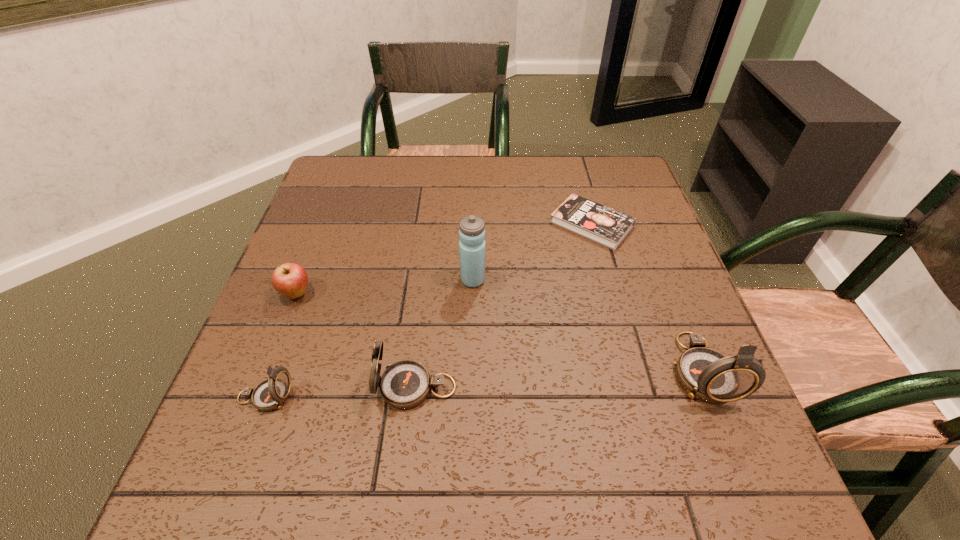
Locate an element on the screen. The image size is (960, 540). free space between the apple and the leftmost compass is located at coordinates (281, 345).

Locate an element on the screen. This screenshot has width=960, height=540. unoccupied area between the leftmost compass and the rightmost compass is located at coordinates (483, 383).

The width and height of the screenshot is (960, 540). I want to click on free space between the water bottle and the fourth shortest object, so click(x=444, y=334).

The width and height of the screenshot is (960, 540). I want to click on vacant space in between the shortest object and the fourth object from left to right, so click(532, 252).

Where is `vacant space that is in between the apple and the second compass from left to right`? vacant space that is in between the apple and the second compass from left to right is located at coordinates (356, 340).

Locate an element on the screen. The width and height of the screenshot is (960, 540). vacant space in between the shortest object and the rightmost compass is located at coordinates (646, 297).

Where is `empty location between the book and the third object from right to left`? empty location between the book and the third object from right to left is located at coordinates (532, 252).

At what (x,y) coordinates should I click in order to perform the action: click on empty space that is in between the shortest compass and the shortest object. Please return your answer as a coordinate pair (x, y). Image resolution: width=960 pixels, height=540 pixels. Looking at the image, I should click on (428, 310).

This screenshot has height=540, width=960. Identify the location of free area in between the apple and the shortest compass. (281, 345).

At what (x,y) coordinates should I click in order to perform the action: click on free spot between the second shortest compass and the apple. Please return your answer as a coordinate pair (x, y). The image size is (960, 540). Looking at the image, I should click on (356, 340).